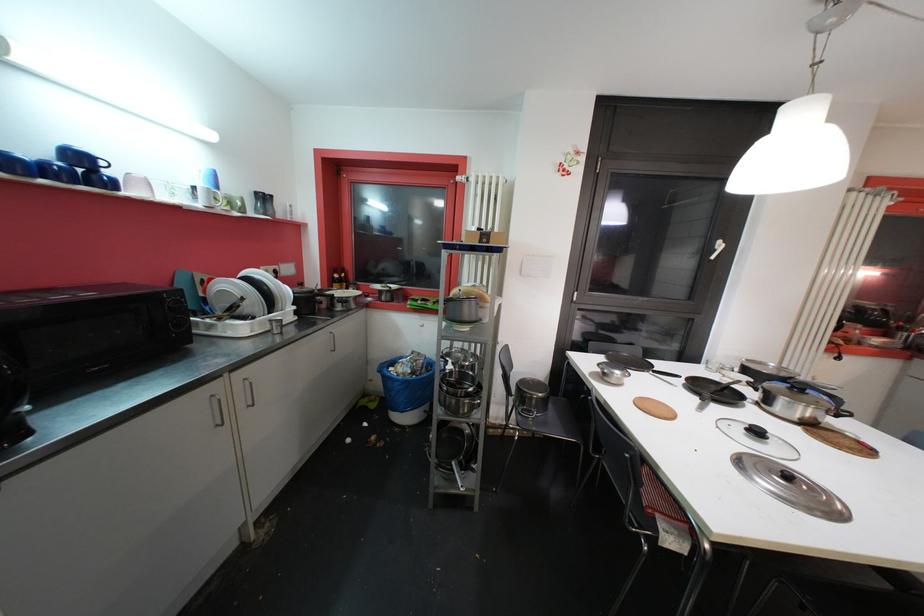
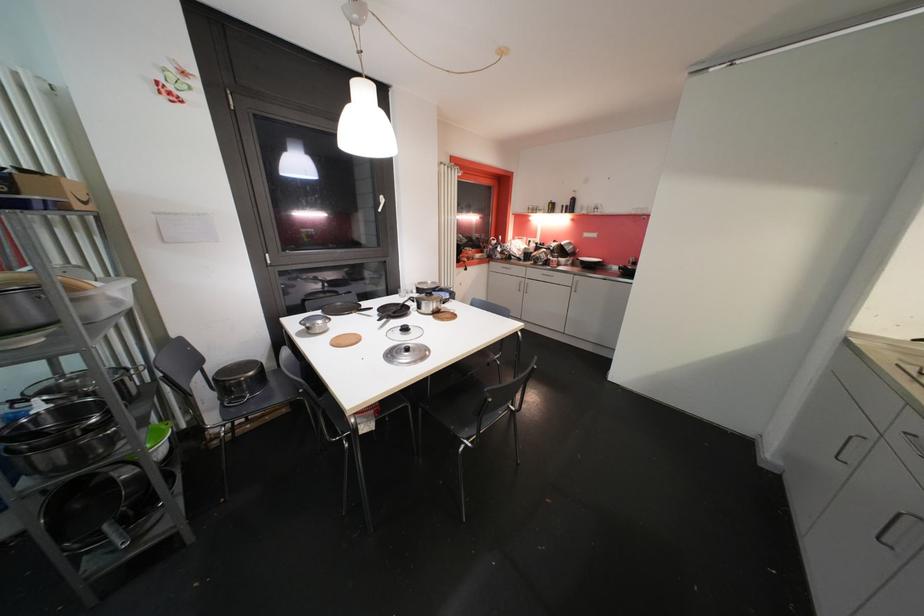
Where in the second image is the point corresponding to (x=457, y=464) from the first image?

(111, 529)